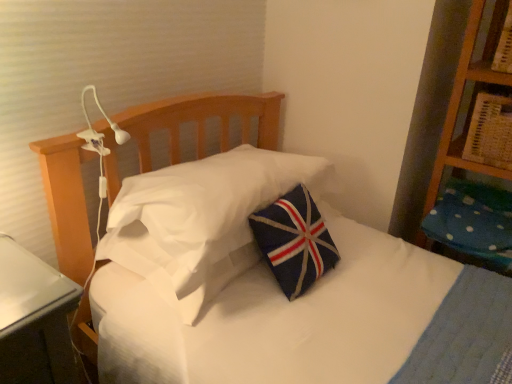
Question: From the image's perspective, is blue dotted fabric pillow at right, acting as the first pillow starting from the right, above navy felt pillow at center, placed as the 1th pillow when sorted from left to right?

Choices:
 (A) no
 (B) yes

Answer: (A)

Question: From the image's perspective, does blue dotted fabric pillow at right, acting as the first pillow starting from the right, appear lower than navy felt pillow at center, the 2th pillow in the right-to-left sequence?

Choices:
 (A) yes
 (B) no

Answer: (A)

Question: Can you confirm if blue dotted fabric pillow at right, acting as the first pillow starting from the right, is thinner than navy felt pillow at center, placed as the 1th pillow when sorted from left to right?

Choices:
 (A) no
 (B) yes

Answer: (A)

Question: Considering the relative sizes of blue dotted fabric pillow at right, acting as the 2th pillow starting from the left, and navy felt pillow at center, placed as the 1th pillow when sorted from left to right, in the image provided, is blue dotted fabric pillow at right, acting as the 2th pillow starting from the left, wider than navy felt pillow at center, placed as the 1th pillow when sorted from left to right,?

Choices:
 (A) yes
 (B) no

Answer: (A)

Question: Is blue dotted fabric pillow at right, acting as the first pillow starting from the right, closer to camera compared to navy felt pillow at center, placed as the 1th pillow when sorted from left to right?

Choices:
 (A) yes
 (B) no

Answer: (B)

Question: Considering the positions of wooden bookshelf at upper right and blue dotted fabric pillow at right, acting as the 2th pillow starting from the left, in the image, is wooden bookshelf at upper right taller or shorter than blue dotted fabric pillow at right, acting as the 2th pillow starting from the left,?

Choices:
 (A) short
 (B) tall

Answer: (B)

Question: In the image, is wooden bookshelf at upper right positioned in front of or behind blue dotted fabric pillow at right, acting as the first pillow starting from the right?

Choices:
 (A) front
 (B) behind

Answer: (A)

Question: Would you say wooden bookshelf at upper right is to the left or to the right of blue dotted fabric pillow at right, acting as the first pillow starting from the right, in the picture?

Choices:
 (A) left
 (B) right

Answer: (A)

Question: Considering the positions of wooden bookshelf at upper right and blue dotted fabric pillow at right, acting as the 2th pillow starting from the left, in the image, is wooden bookshelf at upper right bigger or smaller than blue dotted fabric pillow at right, acting as the 2th pillow starting from the left,?

Choices:
 (A) small
 (B) big

Answer: (A)

Question: Is point (448, 125) positioned closer to the camera than point (137, 266)?

Choices:
 (A) closer
 (B) farther

Answer: (B)

Question: Looking at the image, does wooden bookshelf at upper right seem bigger or smaller compared to navy felt pillow at center, the 2th pillow in the right-to-left sequence?

Choices:
 (A) big
 (B) small

Answer: (B)

Question: In the image, is wooden bookshelf at upper right positioned in front of or behind navy felt pillow at center, placed as the 1th pillow when sorted from left to right?

Choices:
 (A) behind
 (B) front

Answer: (A)

Question: Considering the positions of wooden bookshelf at upper right and navy felt pillow at center, the 2th pillow in the right-to-left sequence, in the image, is wooden bookshelf at upper right taller or shorter than navy felt pillow at center, the 2th pillow in the right-to-left sequence,?

Choices:
 (A) tall
 (B) short

Answer: (A)

Question: Would you say blue dotted fabric pillow at right, acting as the first pillow starting from the right, is inside or outside navy felt pillow at center, placed as the 1th pillow when sorted from left to right?

Choices:
 (A) outside
 (B) inside

Answer: (A)

Question: From a real-world perspective, is blue dotted fabric pillow at right, acting as the first pillow starting from the right, above or below navy felt pillow at center, the 2th pillow in the right-to-left sequence?

Choices:
 (A) above
 (B) below

Answer: (B)